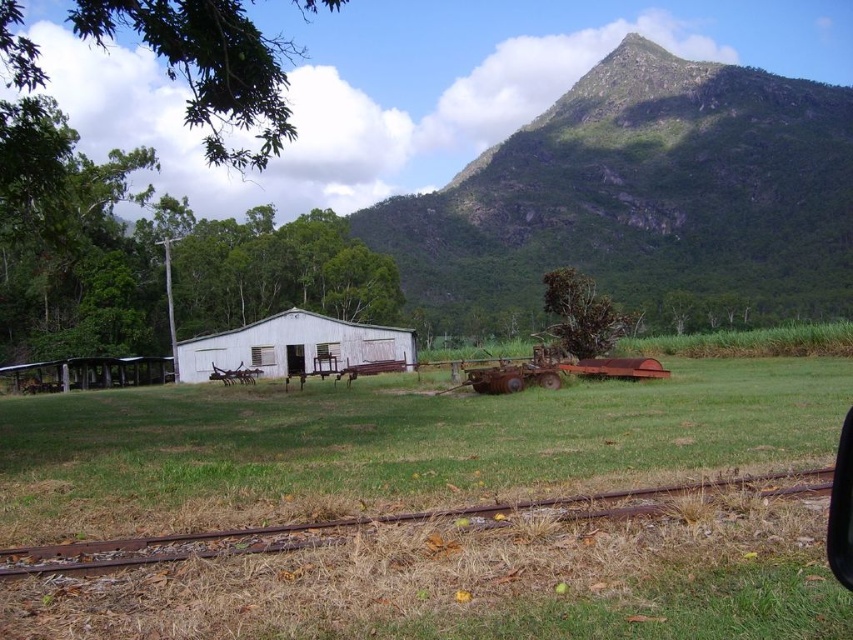
From the picture: You are driving a car and notice the transparent glass car window at lower right. You want to park your car so that the white matte barn at center is visible through the window. Is the barn tall enough to be seen through the window from this position?

The white matte barn at center is taller than the transparent glass car window at lower right, so yes, the barn will be visible through the window as it extends above the window frame.

You are standing at the entrance of the white shed and want to reach the point marked as point (x=844, y=497). Is the point (x=589, y=102) located behind or in front of your path to that destination?

Point (x=589, y=102) is behind point (x=844, y=497), so it is not on your path to the destination and is located behind your current position.

You are a painter planning to capture the rural scene. You want to ensure the green rocky mountain at upper center and the white matte barn at center are both visible in your painting. Which object should you make wider to fit the composition better?

The green rocky mountain at upper center is wider than the white matte barn at center, so you should make the green rocky mountain at upper center wider to accommodate its actual width in the painting.